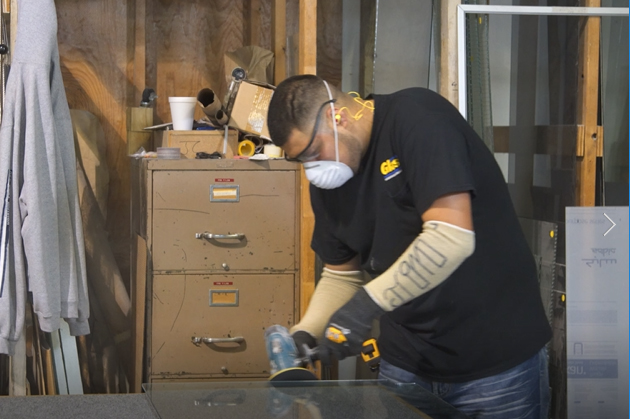
Find the location of a particular element. handle is located at coordinates (222, 233).